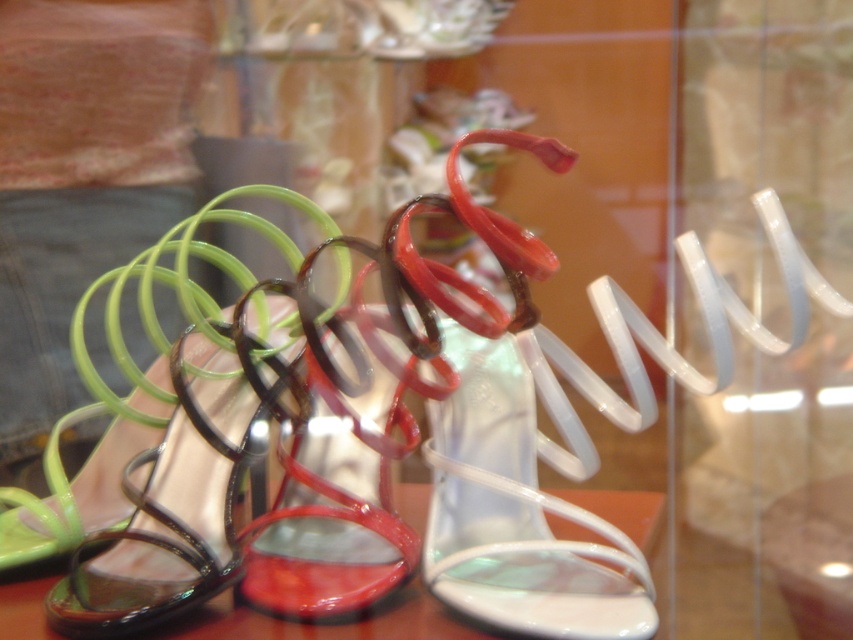
Measure the distance between glossy plastic sandal at center and camera.

glossy plastic sandal at center and camera are 23.83 inches apart from each other.

Does glossy plastic sandal at center have a larger size compared to green glossy sandal at left?

No.

Find the location of a particular element. This screenshot has height=640, width=853. glossy plastic sandal at center is located at coordinates (341, 458).